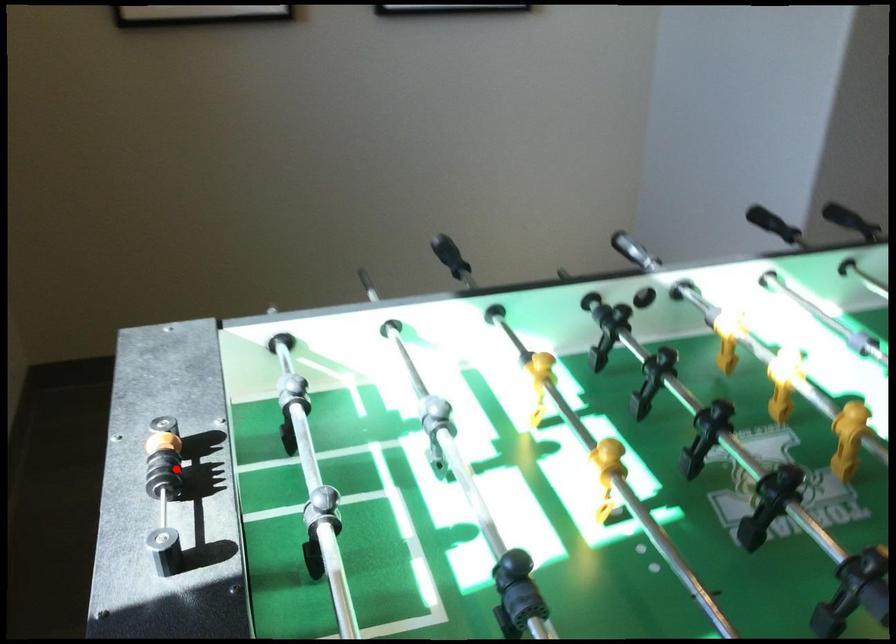
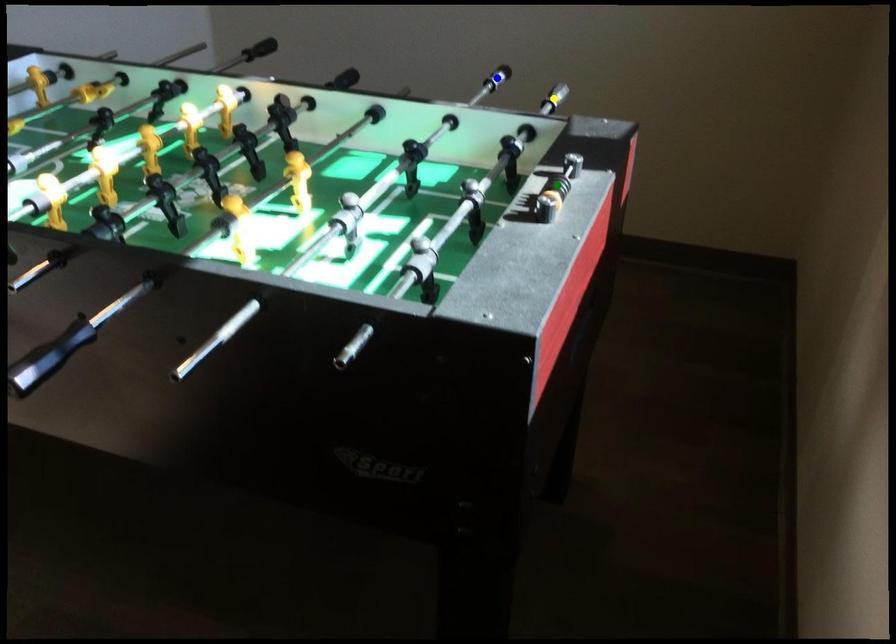
Question: I am providing you with two images of the same scene from different viewpoints. A red point is marked on the first image. You are given multiple points on the second image. Can you choose the point in image 2 that corresponds to the point in image 1?

Choices:
 (A) yellow point
 (B) blue point
 (C) green point

Answer: (C)